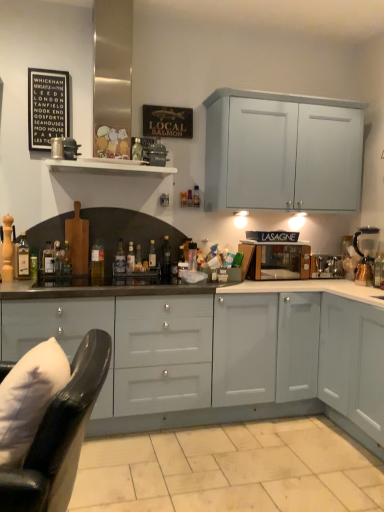
Where is `translucent glass bottle at center, which ranks as the 4th bottle in right-to-left order`? translucent glass bottle at center, which ranks as the 4th bottle in right-to-left order is located at coordinates (130, 258).

Describe the element at coordinates (326, 266) in the screenshot. This screenshot has height=512, width=384. I see `satin silver toaster at right, acting as the 1th appliance starting from the right` at that location.

Measure the distance between point (372, 280) and camera.

The distance of point (372, 280) from camera is 9.86 feet.

What do you see at coordinates (23, 258) in the screenshot? I see `translucent glass bottle at left, which is counted as the 2th bottle, starting from the left` at bounding box center [23, 258].

What do you see at coordinates (120, 258) in the screenshot?
I see `translucent glass bottle at center, the fifth bottle when ordered from right to left` at bounding box center [120, 258].

Measure the distance between translucent glass bottle at center, which is the 10th bottle in left-to-right order, and camera.

The distance of translucent glass bottle at center, which is the 10th bottle in left-to-right order, from camera is 9.99 feet.

What is the approximate height of translucent glass bottle at center, which is counted as the second bottle, starting from the right?

translucent glass bottle at center, which is counted as the second bottle, starting from the right, is 24.92 centimeters in height.

The image size is (384, 512). I want to click on translucent glass bottle at center, arranged as the 8th bottle when viewed from the left, so click(130, 258).

Is black glass bottle at center, positioned as the 1th bottle in right-to-left order, located outside translucent glass bottle at center, which is counted as the second bottle, starting from the right?

Yes.

Is the depth of black glass bottle at center, positioned as the 1th bottle in right-to-left order, greater than that of translucent glass bottle at center, which is counted as the second bottle, starting from the right?

No, it is in front of translucent glass bottle at center, which is counted as the second bottle, starting from the right.

Considering the positions of objects black glass bottle at center, which appears as the 11th bottle when viewed from the left, and translucent glass bottle at center, which is the 10th bottle in left-to-right order, in the image provided, who is more to the left, black glass bottle at center, which appears as the 11th bottle when viewed from the left, or translucent glass bottle at center, which is the 10th bottle in left-to-right order,?

Positioned to the left is translucent glass bottle at center, which is the 10th bottle in left-to-right order.

From a real-world perspective, does black glass bottle at center, which appears as the 11th bottle when viewed from the left, stand above translucent glass bottle at center, which is counted as the second bottle, starting from the right?

Yes, from a real-world perspective, black glass bottle at center, which appears as the 11th bottle when viewed from the left, is above translucent glass bottle at center, which is counted as the second bottle, starting from the right.

Which of these two, white soft pillow at lower left or translucent glass bottle at center, which is the 10th bottle in left-to-right order, is wider?

white soft pillow at lower left.

Would you say white soft pillow at lower left is a long distance from translucent glass bottle at center, which is counted as the second bottle, starting from the right?

Yes.

Which of these two, white soft pillow at lower left or translucent glass bottle at center, which is counted as the second bottle, starting from the right, is bigger?

Bigger between the two is white soft pillow at lower left.

Does point (11, 378) appear closer or farther from the camera than point (154, 246)?

Point (11, 378) appears to be closer to the viewer than point (154, 246).

Is satin silver toaster at right, acting as the 1th appliance starting from the right, next to translucent glass bottle at center-left, which ranks as the seventh bottle in right-to-left order?

No, satin silver toaster at right, acting as the 1th appliance starting from the right, is not beside translucent glass bottle at center-left, which ranks as the seventh bottle in right-to-left order.

Would you say satin silver toaster at right, which is counted as the 2th appliance, starting from the left, contains translucent glass bottle at center-left, which ranks as the seventh bottle in right-to-left order?

Actually, translucent glass bottle at center-left, which ranks as the seventh bottle in right-to-left order, is outside satin silver toaster at right, which is counted as the 2th appliance, starting from the left.

Who is bigger, satin silver toaster at right, acting as the 1th appliance starting from the right, or translucent glass bottle at center-left, which ranks as the seventh bottle in right-to-left order?

satin silver toaster at right, acting as the 1th appliance starting from the right, is bigger.

Considering the positions of objects satin silver toaster at right, acting as the 1th appliance starting from the right, and translucent glass bottle at center-left, which ranks as the seventh bottle in right-to-left order, in the image provided, who is behind, satin silver toaster at right, acting as the 1th appliance starting from the right, or translucent glass bottle at center-left, which ranks as the seventh bottle in right-to-left order,?

satin silver toaster at right, acting as the 1th appliance starting from the right, is further away from the camera.

Would you say beige tile at lower center is inside or outside translucent glass bottle at center, which appears as the 9th bottle when viewed from the right?

beige tile at lower center is located beyond the bounds of translucent glass bottle at center, which appears as the 9th bottle when viewed from the right.

In terms of width, does beige tile at lower center look wider or thinner when compared to translucent glass bottle at center, acting as the 3th bottle starting from the left?

In the image, beige tile at lower center appears to be wider than translucent glass bottle at center, acting as the 3th bottle starting from the left.

I want to click on tile below the translucent glass bottle at center, which appears as the 9th bottle when viewed from the right (from a real-world perspective), so click(x=231, y=470).

In the scene shown: Considering the sizes of beige tile at lower center and translucent glass bottle at center, acting as the 3th bottle starting from the left, in the image, is beige tile at lower center taller or shorter than translucent glass bottle at center, acting as the 3th bottle starting from the left,?

Clearly, beige tile at lower center is shorter compared to translucent glass bottle at center, acting as the 3th bottle starting from the left.

Does translucent glass bottle at center, which is counted as the second bottle, starting from the right, turn towards translucent glass bottle at center, which appears as the 9th bottle when viewed from the right?

No, translucent glass bottle at center, which is counted as the second bottle, starting from the right, is not facing towards translucent glass bottle at center, which appears as the 9th bottle when viewed from the right.

Does point (152, 243) appear closer or farther from the camera than point (52, 254)?

Clearly, point (152, 243) is more distant from the camera than point (52, 254).

Are translucent glass bottle at center, which is counted as the second bottle, starting from the right, and translucent glass bottle at center, acting as the 3th bottle starting from the left, making contact?

No, translucent glass bottle at center, which is counted as the second bottle, starting from the right, is not touching translucent glass bottle at center, acting as the 3th bottle starting from the left.

The height and width of the screenshot is (512, 384). What are the coordinates of `the 8th bottle behind when counting from the translucent glass bottle at center, which appears as the 9th bottle when viewed from the right` in the screenshot? It's located at (152, 254).

Does black glass bottle at center, which appears as the 11th bottle when viewed from the left, have a greater width compared to wooden pepper mill at left, which is the 1th bottle in left-to-right order?

Correct, the width of black glass bottle at center, which appears as the 11th bottle when viewed from the left, exceeds that of wooden pepper mill at left, which is the 1th bottle in left-to-right order.

Which object is closer to the camera, black glass bottle at center, which appears as the 11th bottle when viewed from the left, or wooden pepper mill at left, which is the 1th bottle in left-to-right order?

wooden pepper mill at left, which is the 1th bottle in left-to-right order, is in front.

How many degrees apart are the facing directions of black glass bottle at center, positioned as the 1th bottle in right-to-left order, and wooden pepper mill at left, which is the 1th bottle in left-to-right order?

The angle between the facing direction of black glass bottle at center, positioned as the 1th bottle in right-to-left order, and the facing direction of wooden pepper mill at left, which is the 1th bottle in left-to-right order, is 0.00151 degrees.

In the scene shown: Can we say black glass bottle at center, which appears as the 11th bottle when viewed from the left, lies outside wooden pepper mill at left, the eleventh bottle from the right?

That's correct, black glass bottle at center, which appears as the 11th bottle when viewed from the left, is outside of wooden pepper mill at left, the eleventh bottle from the right.

Is black paper at upper left positioned beyond the bounds of satin silver toaster at right, acting as the 1th appliance starting from the right?

Yes, black paper at upper left is outside of satin silver toaster at right, acting as the 1th appliance starting from the right.

Does black paper at upper left appear on the right side of satin silver toaster at right, which is counted as the 2th appliance, starting from the left?

No, black paper at upper left is not to the right of satin silver toaster at right, which is counted as the 2th appliance, starting from the left.

Considering the sizes of objects black paper at upper left and satin silver toaster at right, acting as the 1th appliance starting from the right, in the image provided, who is shorter, black paper at upper left or satin silver toaster at right, acting as the 1th appliance starting from the right,?

satin silver toaster at right, acting as the 1th appliance starting from the right, is shorter.

How many degrees apart are the facing directions of black paper at upper left and satin silver toaster at right, which is counted as the 2th appliance, starting from the left?

0.00524 degrees.

In order to click on the 1st bottle below when counting from the black glass bottle at center, which appears as the 11th bottle when viewed from the left (from the image's perspective) in this screenshot , I will do `click(152, 254)`.

Locate an element on the screen. The width and height of the screenshot is (384, 512). bottle that is the 8th object located above the white soft pillow at lower left (from the image's perspective) is located at coordinates (152, 254).

Looking at the image, which one is located closer to matte brown microwave at center, the second appliance viewed from the right, wooden pepper mill at left, the eleventh bottle from the right, or translucent glass bottle at left, which is the 10th bottle in right-to-left order?

translucent glass bottle at left, which is the 10th bottle in right-to-left order.

Looking at the image, which one is located closer to translucent glass bottle at center, which appears as the 9th bottle when viewed from the right, translucent glass bottle at center, the fifth bottle when ordered from right to left, or black leather swivel chair at lower left?

Based on the image, translucent glass bottle at center, the fifth bottle when ordered from right to left, appears to be nearer to translucent glass bottle at center, which appears as the 9th bottle when viewed from the right.

Considering their positions, is translucent glass bottle at center, the sixth bottle viewed from the right, positioned closer to translucent glass bottle at center-left, marked as the 5th bottle in a left-to-right arrangement, than translucent glass bottle at center, the fifth bottle when ordered from right to left?

The object closer to translucent glass bottle at center-left, marked as the 5th bottle in a left-to-right arrangement, is translucent glass bottle at center, the sixth bottle viewed from the right.

Which object lies nearer to the anchor point black glass bottle at center, which appears as the 11th bottle when viewed from the left, metallic gold coffee machine at right or black leather swivel chair at lower left?

Among the two, metallic gold coffee machine at right is located nearer to black glass bottle at center, which appears as the 11th bottle when viewed from the left.

Estimate the real-world distances between objects in this image. Which object is further from black glass bottle at center, positioned as the 1th bottle in right-to-left order, translucent glass bottle at left, which is the 10th bottle in right-to-left order, or metallic gold coffee machine at right?

metallic gold coffee machine at right.

From the picture: Which object lies nearer to the anchor point translucent glass bottle at center, which is the 10th bottle in left-to-right order, translucent glass bottle at center, placed as the 6th bottle when sorted from left to right, or white wooden shelf at upper center?

translucent glass bottle at center, placed as the 6th bottle when sorted from left to right.

Considering their positions, is black leather swivel chair at lower left positioned further to beige tile at lower center than translucent glass bottle at center, which is the 7th bottle in left-to-right order?

black leather swivel chair at lower left is further to beige tile at lower center.

Based on their spatial positions, is beige tile at lower center or translucent glass bottle at center, which is the 9th bottle in left-to-right order, further from translucent glass bottle at center, which is the 10th bottle in left-to-right order?

The object further to translucent glass bottle at center, which is the 10th bottle in left-to-right order, is beige tile at lower center.

You are a GUI agent. You are given a task and a screenshot of the screen. Output one action in this format:
    pyautogui.click(x=<x>, y=<y>)
    Task: Click on the appliance between white soft pillow at lower left and satin silver toaster at right, acting as the 1th appliance starting from the right, along the z-axis
    Image resolution: width=384 pixels, height=512 pixels.
    Given the screenshot: What is the action you would take?
    pyautogui.click(x=277, y=260)

I want to click on cabinetry between white soft pillow at lower left and translucent glass bottle at center, which is counted as the second bottle, starting from the right, along the z-axis, so click(x=286, y=358).

This screenshot has width=384, height=512. Identify the location of tile between black leather swivel chair at lower left and translucent glass bottle at center, the sixth bottle viewed from the right, in the front-back direction. (231, 470).

Where is `appliance between translucent glass bottle at center, arranged as the 8th bottle when viewed from the left, and satin silver toaster at right, acting as the 1th appliance starting from the right`? appliance between translucent glass bottle at center, arranged as the 8th bottle when viewed from the left, and satin silver toaster at right, acting as the 1th appliance starting from the right is located at coordinates (277, 260).